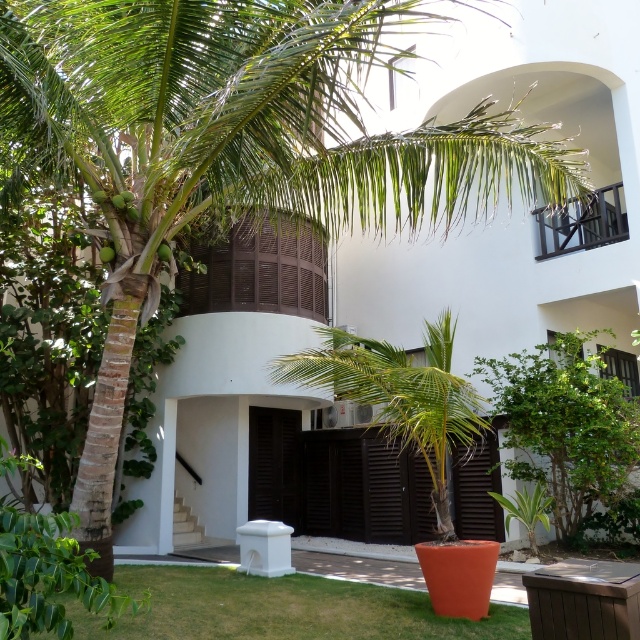
Question: Which point is farther to the camera?

Choices:
 (A) green grass at lower left
 (B) green leafy palm tree at center

Answer: (B)

Question: Is green grass at lower left thinner than green leafy palm tree at center?

Choices:
 (A) yes
 (B) no

Answer: (B)

Question: Which point is farther from the camera taking this photo?

Choices:
 (A) (330, 376)
 (B) (401, 627)

Answer: (A)

Question: Is green grass at lower left below green leafy palm tree at center?

Choices:
 (A) yes
 (B) no

Answer: (A)

Question: Does green grass at lower left appear under green leafy palm tree at center?

Choices:
 (A) yes
 (B) no

Answer: (A)